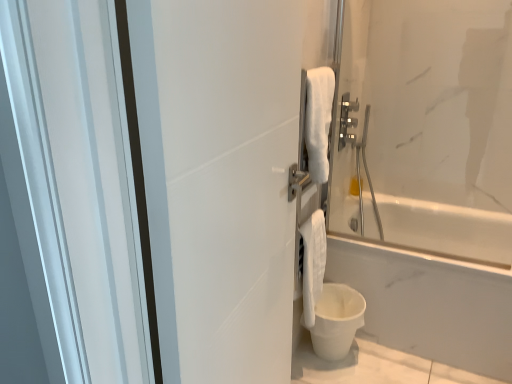
The width and height of the screenshot is (512, 384). What do you see at coordinates (226, 186) in the screenshot?
I see `white matte screen door at center` at bounding box center [226, 186].

In order to face white soft towel at lower right, should I rotate leftwards or rightwards?

You should rotate right by 7.830 degrees.

Find the location of `satin nickel towel bar at upper right`. satin nickel towel bar at upper right is located at coordinates (347, 121).

The image size is (512, 384). I want to click on white matte screen door at center, so click(x=226, y=186).

Considering the relative sizes of satin nickel towel bar at upper right and white matte bucket at lower right in the image provided, is satin nickel towel bar at upper right bigger than white matte bucket at lower right?

No, satin nickel towel bar at upper right is not bigger than white matte bucket at lower right.

Where is `towel bar behind the white matte bucket at lower right`? towel bar behind the white matte bucket at lower right is located at coordinates (347, 121).

Is satin nickel towel bar at upper right not within white matte bucket at lower right?

Yes, satin nickel towel bar at upper right is not within white matte bucket at lower right.

Is satin nickel towel bar at upper right turned away from white matte bucket at lower right?

No, satin nickel towel bar at upper right's orientation is not away from white matte bucket at lower right.

Looking at this image, considering the sizes of objects white matte screen door at center and white matte bucket at lower right in the image provided, who is shorter, white matte screen door at center or white matte bucket at lower right?

With less height is white matte bucket at lower right.

Where is `screen door lying on the left of white matte bucket at lower right`? The width and height of the screenshot is (512, 384). screen door lying on the left of white matte bucket at lower right is located at coordinates (226, 186).

Which of these two, white matte screen door at center or white matte bucket at lower right, is wider?

white matte bucket at lower right.

Can you tell me how much white matte screen door at center and white matte bucket at lower right differ in facing direction?

3.48 degrees separate the facing orientations of white matte screen door at center and white matte bucket at lower right.

Considering the sizes of objects satin nickel towel bar at upper right and white matte screen door at center in the image provided, who is shorter, satin nickel towel bar at upper right or white matte screen door at center?

satin nickel towel bar at upper right.

Would you say white matte screen door at center is part of satin nickel towel bar at upper right's contents?

No, white matte screen door at center is not a part of satin nickel towel bar at upper right.

From a real-world perspective, does satin nickel towel bar at upper right sit lower than white matte screen door at center?

Incorrect, from a real-world perspective, satin nickel towel bar at upper right is higher than white matte screen door at center.

Could you tell me if satin nickel towel bar at upper right is facing white matte screen door at center?

No, satin nickel towel bar at upper right is not turned towards white matte screen door at center.

From a real-world perspective, is white matte bucket at lower right physically below white matte screen door at center?

Yes, from a real-world perspective, white matte bucket at lower right is under white matte screen door at center.

Is white matte bucket at lower right positioned before white matte screen door at center?

No, it is behind white matte screen door at center.

How distant is white matte bucket at lower right from white matte screen door at center?

white matte bucket at lower right is 98.00 centimeters from white matte screen door at center.

Is white soft towel at lower right smaller than white matte bucket at lower right?

Indeed, white soft towel at lower right has a smaller size compared to white matte bucket at lower right.

Based on the photo, could you tell me if white soft towel at lower right is turned towards white matte bucket at lower right?

No.

Is white matte bucket at lower right surrounded by white soft towel at lower right?

No, white matte bucket at lower right is not a part of white soft towel at lower right.

Is white soft towel at lower right beside white matte bucket at lower right?

No, white soft towel at lower right is not in contact with white matte bucket at lower right.

Considering the positions of objects white matte screen door at center and satin nickel towel bar at upper right in the image provided, who is more to the right, white matte screen door at center or satin nickel towel bar at upper right?

Positioned to the right is satin nickel towel bar at upper right.

At what (x,y) coordinates should I click in order to perform the action: click on towel bar above the white matte screen door at center (from a real-world perspective). Please return your answer as a coordinate pair (x, y). Image resolution: width=512 pixels, height=384 pixels. Looking at the image, I should click on (347, 121).

Which of these two, white matte screen door at center or satin nickel towel bar at upper right, is bigger?

white matte screen door at center is bigger.

Considering the relative sizes of white matte bucket at lower right and satin nickel towel bar at upper right in the image provided, is white matte bucket at lower right shorter than satin nickel towel bar at upper right?

Yes.

Does white matte bucket at lower right have a greater width compared to satin nickel towel bar at upper right?

Yes, white matte bucket at lower right is wider than satin nickel towel bar at upper right.

Does white matte bucket at lower right touch satin nickel towel bar at upper right?

No.

Can you tell me how much white matte bucket at lower right and satin nickel towel bar at upper right differ in facing direction?

There is a 1.83-degree angle between the facing directions of white matte bucket at lower right and satin nickel towel bar at upper right.

The height and width of the screenshot is (384, 512). I want to click on towel bar above the white matte bucket at lower right (from a real-world perspective), so click(x=347, y=121).

Where is `toilet bowl below the white matte screen door at center (from a real-world perspective)`? The height and width of the screenshot is (384, 512). toilet bowl below the white matte screen door at center (from a real-world perspective) is located at coordinates (336, 320).

Looking at the image, which one is located further to white soft towel at lower right, white matte screen door at center or satin nickel towel bar at upper right?

Among the two, satin nickel towel bar at upper right is located further to white soft towel at lower right.

When comparing their distances from satin nickel towel bar at upper right, does white matte screen door at center or white matte bucket at lower right seem further?

white matte screen door at center is further to satin nickel towel bar at upper right.

From the image, which object appears to be nearer to white matte screen door at center, white soft towel at lower right or satin nickel towel bar at upper right?

Among the two, white soft towel at lower right is located nearer to white matte screen door at center.

Considering their positions, is white soft towel at lower right positioned further to satin nickel towel bar at upper right than white matte screen door at center?

Among the two, white matte screen door at center is located further to satin nickel towel bar at upper right.

Looking at the image, which one is located closer to white matte bucket at lower right, white matte screen door at center or satin nickel towel bar at upper right?

Among the two, satin nickel towel bar at upper right is located nearer to white matte bucket at lower right.

Based on their spatial positions, is satin nickel towel bar at upper right or white soft towel at lower right further from white matte screen door at center?

Based on the image, satin nickel towel bar at upper right appears to be further to white matte screen door at center.

Considering their positions, is white matte screen door at center positioned further to white soft towel at lower right than white matte bucket at lower right?

white matte screen door at center is further to white soft towel at lower right.

Estimate the real-world distances between objects in this image. Which object is closer to white matte bucket at lower right, white soft towel at lower right or satin nickel towel bar at upper right?

Based on the image, white soft towel at lower right appears to be nearer to white matte bucket at lower right.

I want to click on bath towel between white matte screen door at center and satin nickel towel bar at upper right along the z-axis, so click(x=313, y=263).

You are a GUI agent. You are given a task and a screenshot of the screen. Output one action in this format:
    pyautogui.click(x=<x>, y=<y>)
    Task: Click on the bath towel located between white matte screen door at center and white matte bucket at lower right in the depth direction
    
    Given the screenshot: What is the action you would take?
    pyautogui.click(x=313, y=263)

Find the location of a particular element. This screenshot has width=512, height=384. toilet bowl between white matte screen door at center and satin nickel towel bar at upper right from front to back is located at coordinates (336, 320).

Identify the location of bath towel between satin nickel towel bar at upper right and white matte bucket at lower right in the up-down direction. The width and height of the screenshot is (512, 384). (313, 263).